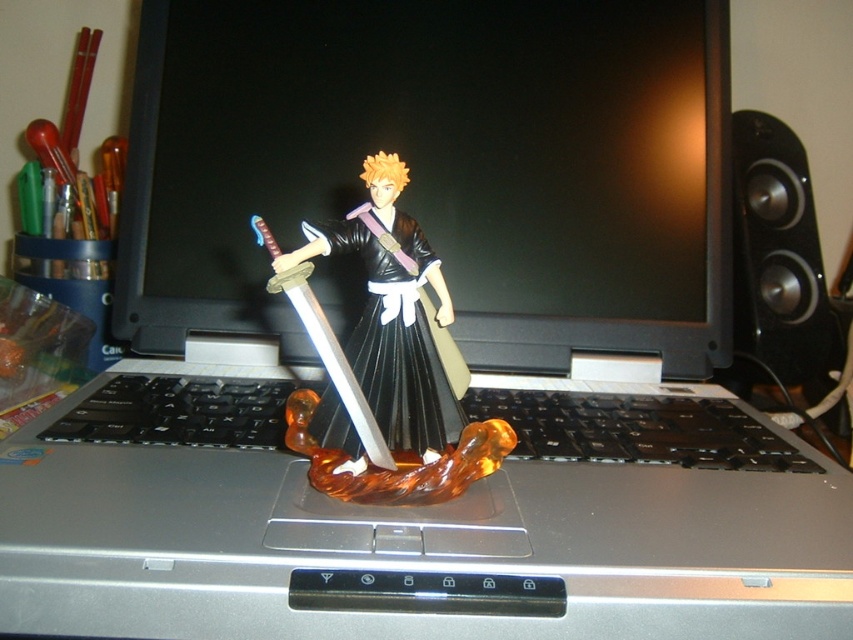
You are a GUI agent. You are given a task and a screenshot of the screen. Output one action in this format:
    pyautogui.click(x=<x>, y=<y>)
    Task: Click on the translucent amber base at center
    
    Given the screenshot: What is the action you would take?
    pyautogui.click(x=396, y=316)

You are a GUI agent. You are given a task and a screenshot of the screen. Output one action in this format:
    pyautogui.click(x=<x>, y=<y>)
    Task: Click on the translucent amber base at center
    This screenshot has width=853, height=640.
    Given the screenshot: What is the action you would take?
    pyautogui.click(x=396, y=316)

Between point (135, 392) and point (738, 138), which one is positioned behind?

The point (738, 138) is behind.

Find the location of a particular element. black plastic keyboard at center is located at coordinates (635, 429).

Between translucent amber base at center and black plastic speaker at right, which one has more height?

Standing taller between the two is black plastic speaker at right.

Is translucent amber base at center further to the viewer compared to black plastic speaker at right?

No, translucent amber base at center is closer to the viewer.

The width and height of the screenshot is (853, 640). In order to click on translucent amber base at center in this screenshot , I will do `click(396, 316)`.